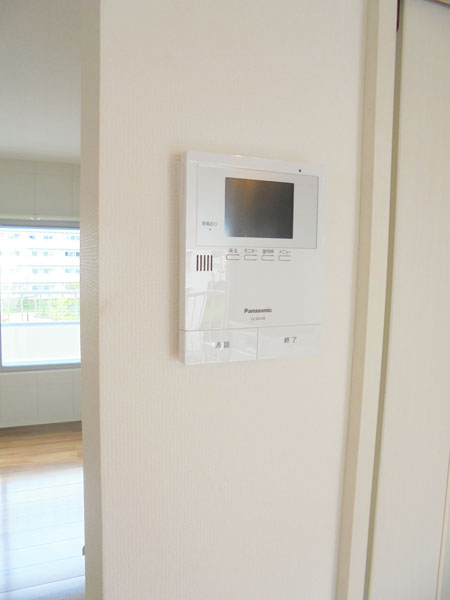
Identify the location of hinge. (395, 20).